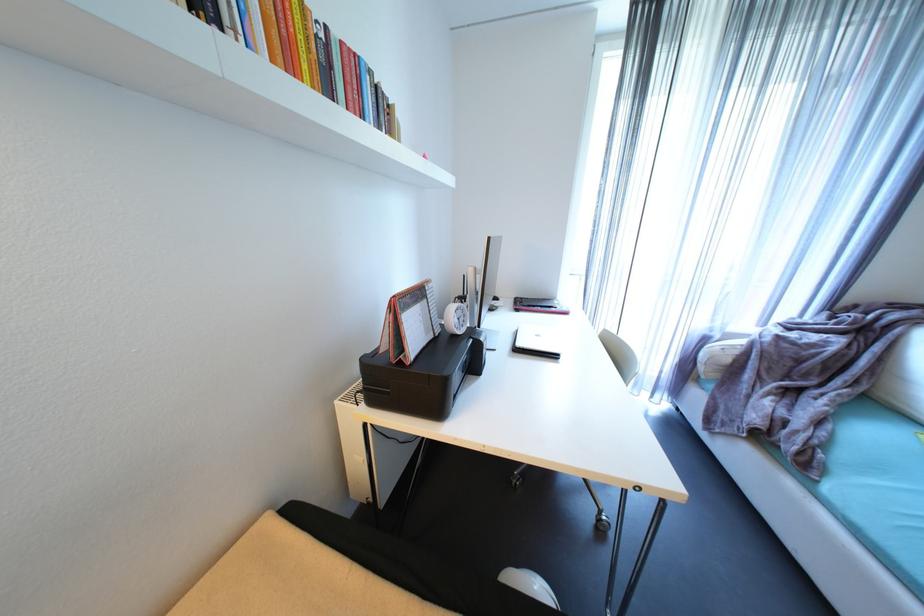
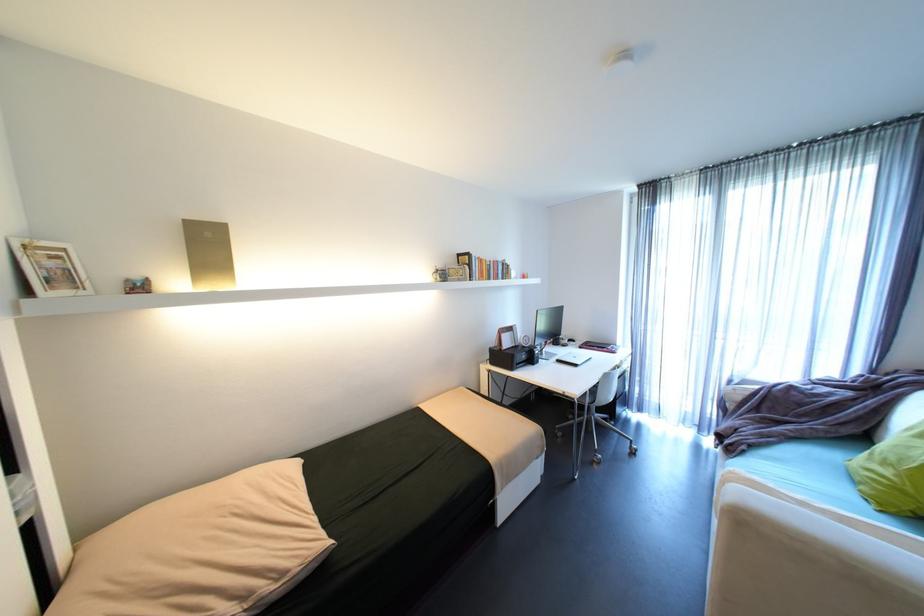
Find the pixel in the second image that matches [347,42] in the first image.

(500, 262)